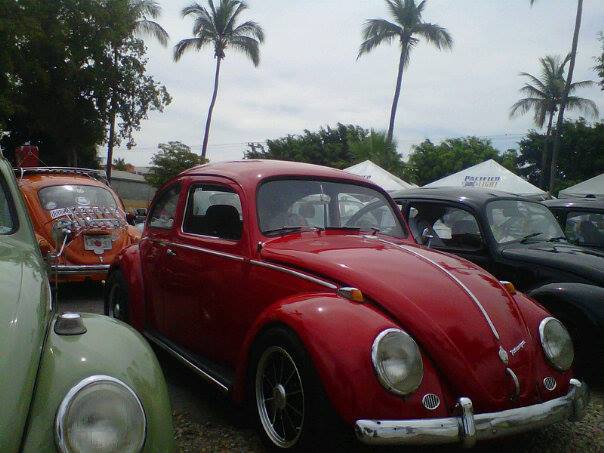
You are a GUI agent. You are given a task and a screenshot of the screen. Output one action in this format:
    pyautogui.click(x=<x>, y=<y>)
    Task: Click on the windows
    Image resolution: width=604 pixels, height=453 pixels.
    Given the screenshot: What is the action you would take?
    pyautogui.click(x=522, y=225), pyautogui.click(x=582, y=229), pyautogui.click(x=461, y=229), pyautogui.click(x=333, y=203), pyautogui.click(x=226, y=218), pyautogui.click(x=88, y=194)